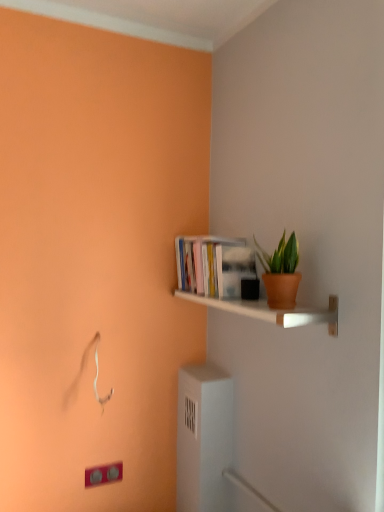
Question: Is white glossy shelf at upper right positioned in front of hardcover books at upper right?

Choices:
 (A) yes
 (B) no

Answer: (A)

Question: Does white glossy shelf at upper right have a greater width compared to hardcover books at upper right?

Choices:
 (A) yes
 (B) no

Answer: (A)

Question: Can you confirm if white glossy shelf at upper right is taller than hardcover books at upper right?

Choices:
 (A) yes
 (B) no

Answer: (B)

Question: From the image's perspective, is white glossy shelf at upper right below hardcover books at upper right?

Choices:
 (A) yes
 (B) no

Answer: (A)

Question: From a real-world perspective, is white glossy shelf at upper right located beneath hardcover books at upper right?

Choices:
 (A) no
 (B) yes

Answer: (B)

Question: Is white glossy shelf at upper right to the right of hardcover books at upper right from the viewer's perspective?

Choices:
 (A) yes
 (B) no

Answer: (A)

Question: Does terracotta clay pot at upper right have a lesser height compared to hardcover books at upper right?

Choices:
 (A) yes
 (B) no

Answer: (A)

Question: Does terracotta clay pot at upper right have a smaller size compared to hardcover books at upper right?

Choices:
 (A) yes
 (B) no

Answer: (A)

Question: Does terracotta clay pot at upper right appear on the left side of hardcover books at upper right?

Choices:
 (A) no
 (B) yes

Answer: (A)

Question: From a real-world perspective, is terracotta clay pot at upper right positioned over hardcover books at upper right based on gravity?

Choices:
 (A) yes
 (B) no

Answer: (B)

Question: Is terracotta clay pot at upper right further to camera compared to hardcover books at upper right?

Choices:
 (A) no
 (B) yes

Answer: (A)

Question: Does terracotta clay pot at upper right have a greater width compared to hardcover books at upper right?

Choices:
 (A) yes
 (B) no

Answer: (B)

Question: Is matte white light switch at lower left next to hardcover books at upper right?

Choices:
 (A) no
 (B) yes

Answer: (A)